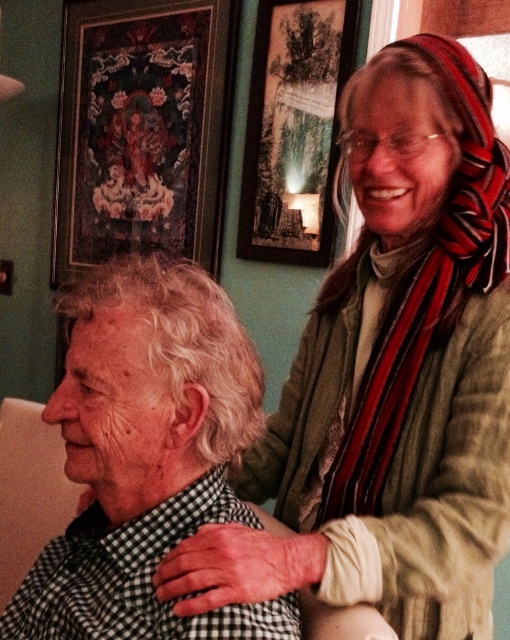
You are an interior designer assessing the wall layout in the scene. You notice two wooden framed artworks on the wall. The wooden framed artwork at upper left and the wooden framed picture at upper center. Which of these two has a greater width?

The wooden framed artwork at upper left has a greater width than the wooden framed picture at upper center.

You are an interior designer who needs to place a new sofa in this room. The sofa will be placed at point (142, 129). What object currently occupies that location?

The wooden framed artwork at upper left is located at point (142, 129), so placing the sofa there would require removing the artwork.

You are a tailor measuring for a new garment. You see the checkered fabric shirt at center and the wooden framed picture at upper center. Which object has a greater width?

The checkered fabric shirt at center is wider than the wooden framed picture at upper center.